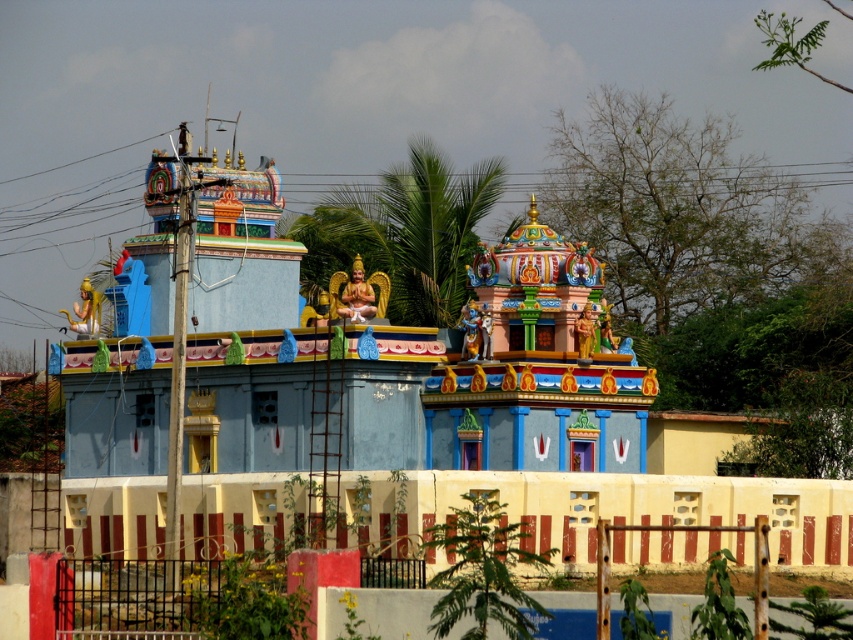
Between gold metallic statue at center and golden statue at upper left, which one has more height?

golden statue at upper left

Where is `gold metallic statue at center`? The height and width of the screenshot is (640, 853). gold metallic statue at center is located at coordinates (357, 294).

Image resolution: width=853 pixels, height=640 pixels. I want to click on gold metallic statue at center, so click(x=357, y=294).

Between golden statue at upper left and golden statue at center, which one has more height?

Standing taller between the two is golden statue at upper left.

Where is `golden statue at upper left`? This screenshot has height=640, width=853. golden statue at upper left is located at coordinates (86, 310).

Which is in front, point (83, 321) or point (587, 317)?

Point (587, 317) is more forward.

Image resolution: width=853 pixels, height=640 pixels. I want to click on golden statue at upper left, so click(86, 310).

Can you confirm if gold metallic statue at center is thinner than golden statue at center?

In fact, gold metallic statue at center might be wider than golden statue at center.

Is point (349, 292) positioned after point (592, 346)?

Yes, it is.

Which is in front, point (360, 259) or point (589, 355)?

Positioned in front is point (589, 355).

Where is `gold metallic statue at center`? Image resolution: width=853 pixels, height=640 pixels. gold metallic statue at center is located at coordinates (357, 294).